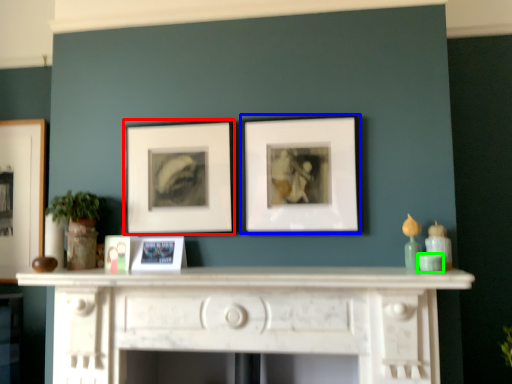
Question: Estimate the real-world distances between objects in this image. Which object is closer to picture frame (highlighted by a red box), picture frame (highlighted by a blue box) or teal (highlighted by a green box)?

Choices:
 (A) picture frame
 (B) teal

Answer: (A)